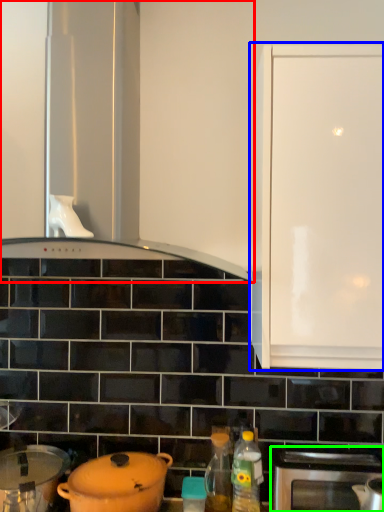
Question: Considering the real-world distances, which object is closest to home appliance (highlighted by a red box)? cabinetry (highlighted by a blue box) or oven (highlighted by a green box).

Choices:
 (A) cabinetry
 (B) oven

Answer: (A)